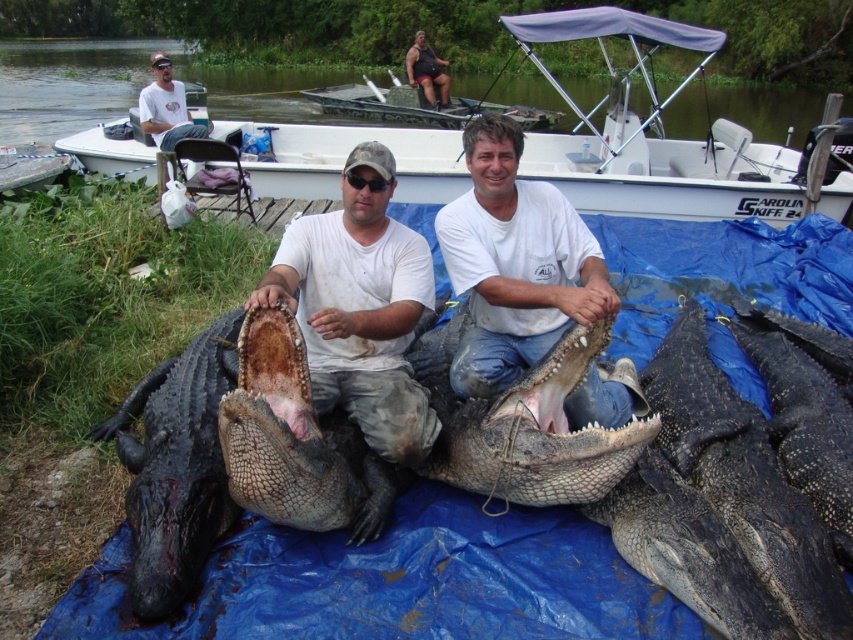
Question: Is white matte shirt at center closer to the viewer compared to rough textured alligator at center?

Choices:
 (A) yes
 (B) no

Answer: (B)

Question: Estimate the real-world distances between objects in this image. Which object is farther from the white matte shirt at center?

Choices:
 (A) matte white shirt at center
 (B) shiny black crocodile at center

Answer: (B)

Question: Is white matte shirt at center wider than rough textured alligator at center?

Choices:
 (A) no
 (B) yes

Answer: (B)

Question: Does white plastic boat at upper center have a smaller size compared to matte white shirt at center?

Choices:
 (A) yes
 (B) no

Answer: (B)

Question: Which point is closer to the camera?

Choices:
 (A) white t-shirt at upper left
 (B) rough textured alligator at center
 (C) white plastic boat at upper center

Answer: (B)

Question: Which of the following is the closest to the observer?

Choices:
 (A) (712, 525)
 (B) (345, 403)
 (C) (177, 80)

Answer: (A)